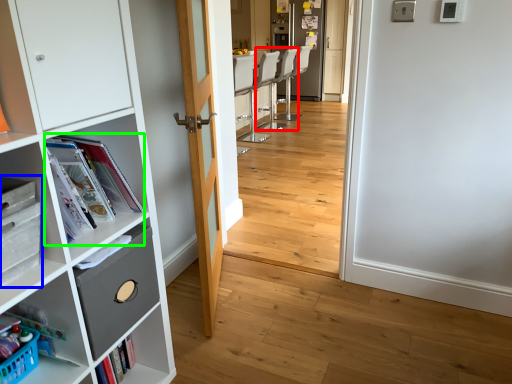
Question: Based on their relative distances, which object is nearer to armchair (highlighted by a red box)? Choose from cabinetry (highlighted by a blue box) and magazine (highlighted by a green box).

Choices:
 (A) cabinetry
 (B) magazine

Answer: (B)